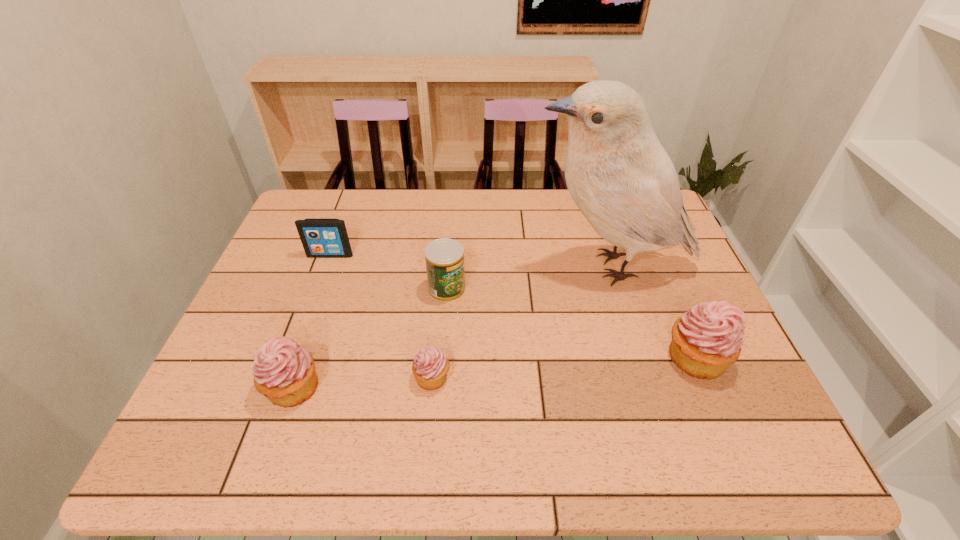
At what (x,y) coordinates should I click in order to perform the action: click on the closest cupcake to the leftmost cupcake. Please return your answer as a coordinate pair (x, y). This screenshot has height=540, width=960. Looking at the image, I should click on click(430, 366).

Find the location of `free spot that satisfies the following two spatial constraints: 1. on the back side of the rightmost cupcake; 2. on the left side of the shortest object`. free spot that satisfies the following two spatial constraints: 1. on the back side of the rightmost cupcake; 2. on the left side of the shortest object is located at coordinates (434, 357).

Where is `free space that satisfies the following two spatial constraints: 1. on the front screen of the iPod; 2. on the right side of the leftmost cupcake`? free space that satisfies the following two spatial constraints: 1. on the front screen of the iPod; 2. on the right side of the leftmost cupcake is located at coordinates (281, 387).

The width and height of the screenshot is (960, 540). I want to click on vacant space that satisfies the following two spatial constraints: 1. on the front screen of the iPod; 2. on the right side of the rightmost cupcake, so click(x=292, y=357).

Locate an element on the screen. The width and height of the screenshot is (960, 540). vacant position in the image that satisfies the following two spatial constraints: 1. on the face of the tallest object; 2. on the left side of the rightmost cupcake is located at coordinates (638, 357).

Locate an element on the screen. vacant space that satisfies the following two spatial constraints: 1. on the back side of the rightmost cupcake; 2. on the face of the parakeet is located at coordinates (657, 267).

You are a GUI agent. You are given a task and a screenshot of the screen. Output one action in this format:
    pyautogui.click(x=<x>, y=<y>)
    Task: Click on the vacant space that satisfies the following two spatial constraints: 1. on the back side of the second shortest cupcake; 2. on the right side of the shortest object
    Image resolution: width=960 pixels, height=540 pixels.
    Given the screenshot: What is the action you would take?
    pyautogui.click(x=297, y=377)